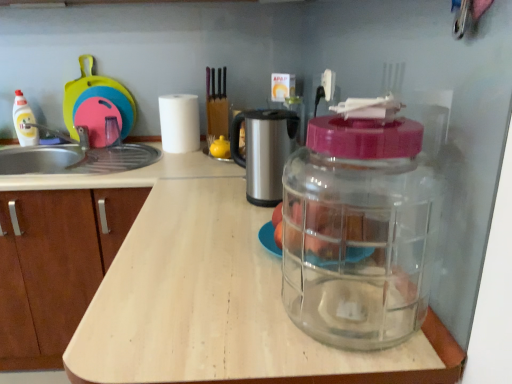
Question: From a real-world perspective, is transparent plastic container at center, which is the first bottle from bottom to top, beneath transparent wood countertop at center?

Choices:
 (A) yes
 (B) no

Answer: (B)

Question: Is transparent plastic container at center, which is the first bottle from bottom to top, smaller than transparent wood countertop at center?

Choices:
 (A) yes
 (B) no

Answer: (A)

Question: Is transparent plastic container at center, which is the 1th bottle from front to back, beside transparent wood countertop at center?

Choices:
 (A) no
 (B) yes

Answer: (A)

Question: Does transparent plastic container at center, which is the 1th bottle from front to back, come behind transparent wood countertop at center?

Choices:
 (A) no
 (B) yes

Answer: (A)

Question: Can you confirm if transparent plastic container at center, which is the second bottle in top-to-bottom order, is wider than transparent wood countertop at center?

Choices:
 (A) yes
 (B) no

Answer: (B)

Question: Is transparent plastic container at center, which is the first bottle from bottom to top, aimed at transparent wood countertop at center?

Choices:
 (A) no
 (B) yes

Answer: (A)

Question: Does stainless steel coffee maker at center have a lesser width compared to white matte paper towel at center?

Choices:
 (A) yes
 (B) no

Answer: (B)

Question: Does stainless steel coffee maker at center turn towards white matte paper towel at center?

Choices:
 (A) yes
 (B) no

Answer: (B)

Question: Can you confirm if stainless steel coffee maker at center is smaller than white matte paper towel at center?

Choices:
 (A) yes
 (B) no

Answer: (B)

Question: From the image's perspective, would you say stainless steel coffee maker at center is positioned over white matte paper towel at center?

Choices:
 (A) yes
 (B) no

Answer: (B)

Question: From the image's perspective, would you say stainless steel coffee maker at center is shown under white matte paper towel at center?

Choices:
 (A) yes
 (B) no

Answer: (A)

Question: Does stainless steel coffee maker at center appear on the right side of white matte paper towel at center?

Choices:
 (A) yes
 (B) no

Answer: (A)

Question: Does transparent wood countertop at center have a lesser width compared to rubberized plastic cutting board at upper left?

Choices:
 (A) no
 (B) yes

Answer: (A)